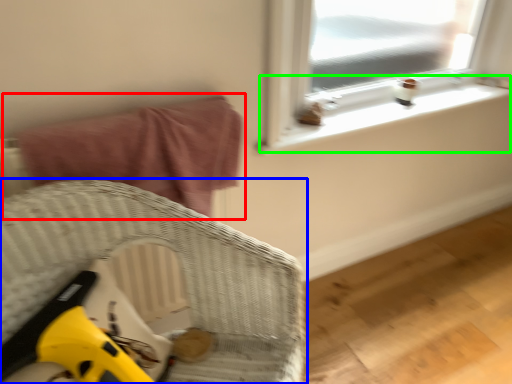
Question: Estimate the real-world distances between objects in this image. Which object is farther from bed (highlighted by a red box), furniture (highlighted by a blue box) or window sill (highlighted by a green box)?

Choices:
 (A) furniture
 (B) window sill

Answer: (B)